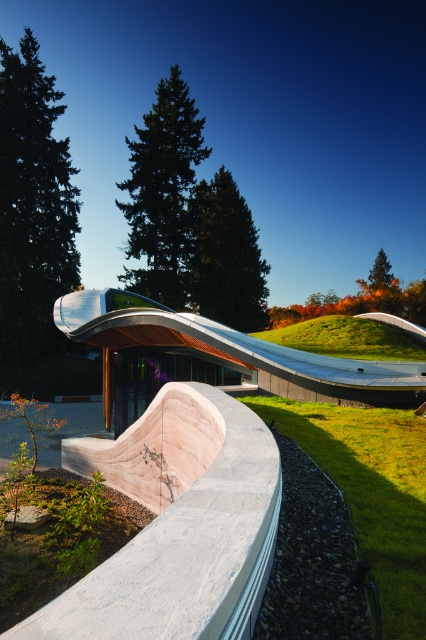
You are a landscape architect designing a walking path between the green grass at lower right and the green grass at upper center. What is the minimum length the path must be to connect them directly?

The minimum length the path must be to connect the green grass at lower right and the green grass at upper center directly is 11.71 meters, as this is the distance between them.

You are a landscape architect designing a garden. You have a green grass at lower right and a silver metallic slide at center. Which object is shorter in height?

The green grass at lower right has a lesser height compared to the silver metallic slide at center, so the green grass at lower right is shorter in height.